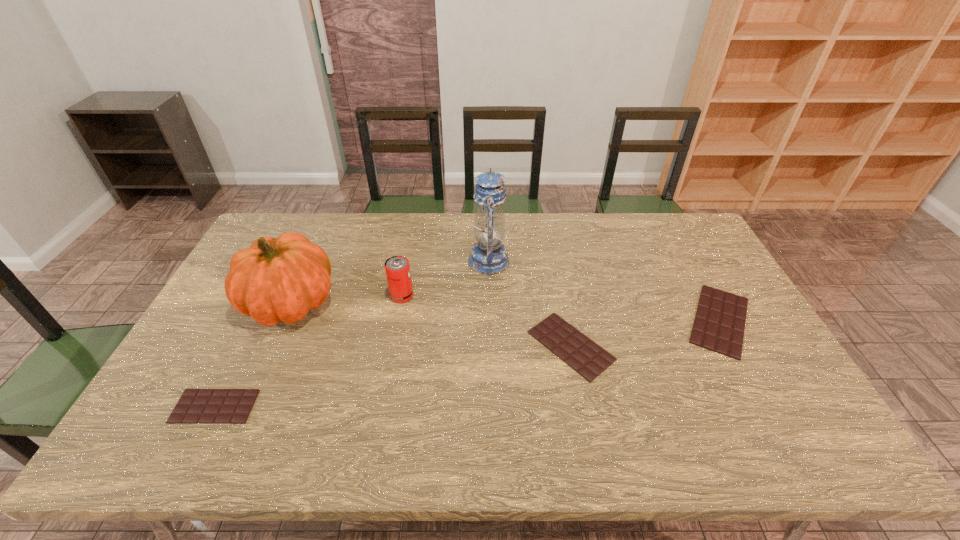
The height and width of the screenshot is (540, 960). Find the location of `chocolate bar that is at the left edge`. chocolate bar that is at the left edge is located at coordinates (196, 406).

Identify the location of pumpkin located in the left edge section of the desktop. (279, 279).

This screenshot has width=960, height=540. I want to click on object situated at the right edge, so click(x=719, y=324).

The height and width of the screenshot is (540, 960). What are the coordinates of `object situated at the near left corner` in the screenshot? It's located at (196, 406).

Locate an element on the screen. This screenshot has width=960, height=540. vacant region at the far edge of the desktop is located at coordinates pyautogui.click(x=343, y=252).

You are a GUI agent. You are given a task and a screenshot of the screen. Output one action in this format:
    pyautogui.click(x=<x>, y=<y>)
    Task: Click on the vacant space at the near edge of the desktop
    
    Given the screenshot: What is the action you would take?
    pyautogui.click(x=304, y=403)

Find the location of a particular element. Image resolution: width=960 pixels, height=540 pixels. free space at the right edge of the desktop is located at coordinates (684, 255).

Where is `free region at the far left corner`? This screenshot has height=540, width=960. free region at the far left corner is located at coordinates (293, 224).

Locate an element on the screen. blank space at the far right corner of the desktop is located at coordinates (662, 240).

This screenshot has width=960, height=540. Identify the location of blank area at the near right corner. (746, 395).